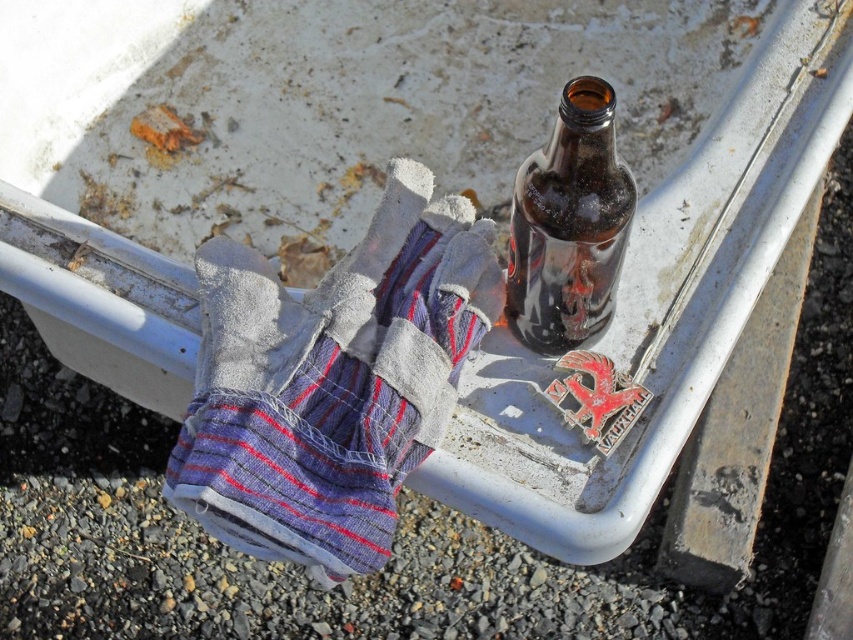
You are a worker needing to place the worn fabric glove at center and the brown glass bottle at center into a storage box. The box has a height limit of 20 cm. Can both items fit vertically without exceeding the height limit?

The worn fabric glove at center is much taller than the brown glass bottle at center. If the glove exceeds 20 cm in height, it would not fit. However, the description does not provide exact measurements, so we cannot confirm if both will fit within the 20 cm height limit.

You are a worker who needs to grab the brown glass bottle at center from the tray. Which direction should you move your hand relative to the worn fabric glove at center to reach it?

The brown glass bottle at center is to the right of the worn fabric glove at center, so you should move your hand to the right of the worn fabric glove at center to reach it.

You are a mechanic working in a garage. You need to place both the worn fabric glove at center and the brown glass bottle at center into a storage box that can only hold one item at a time. Which item should you place first if you want to maximize the box space usage?

The worn fabric glove at center is bigger than the brown glass bottle at center, so you should place the worn fabric glove at center first to maximize the box space usage.